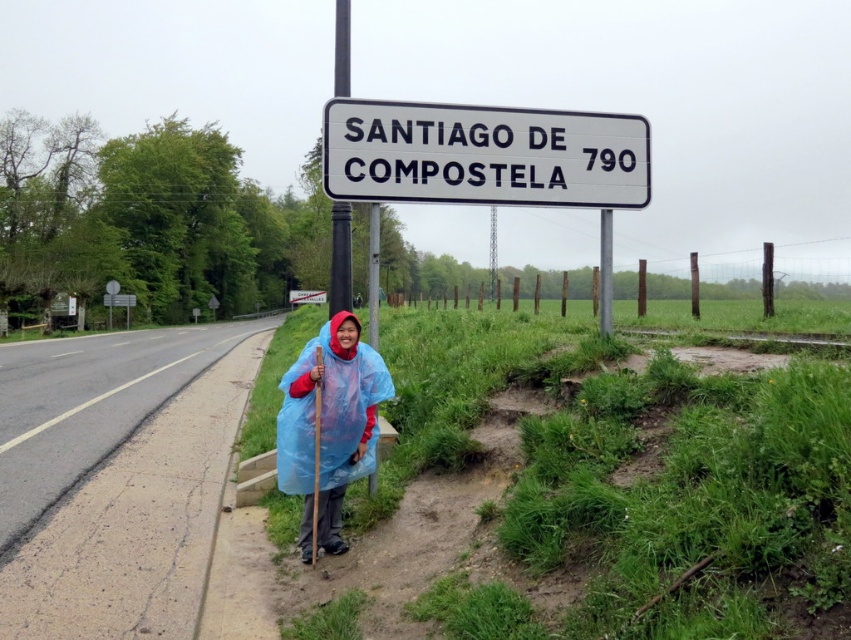
You are a hiker planning to take a photo of the white plastic sign at center and the black metal signpost at upper center. Which object should you focus on first if you want to capture both in one frame without moving the camera?

The white plastic sign at center is below the black metal signpost at upper center, so you should focus on the black metal signpost at upper center first to ensure both are in the frame.

You are a hiker who wants to know if your backpack can fit between the transparent blue poncho at center and the black metal signpost at upper center. Your backpack is 1.2 meters wide. Can it fit?

The transparent blue poncho at center is narrower than the black metal signpost at upper center. However, the exact width of the space between them isn